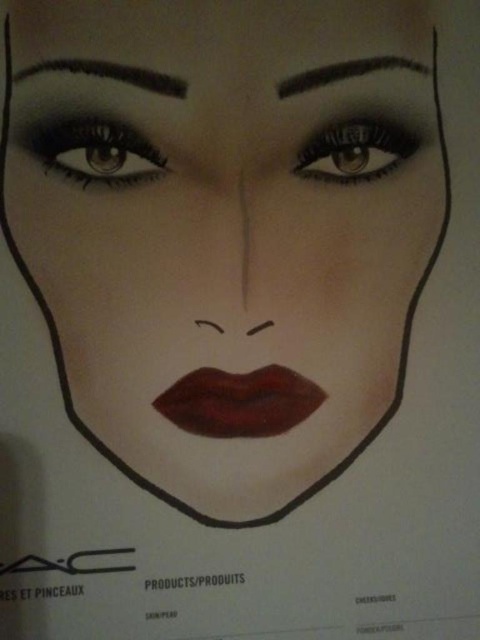
You are a makeup artist trying to apply a new lipstick shade. You have a reference point at coordinates point (240, 401) on the MAC makeup template. Which product should you apply at this point?

The point (240, 401) marks the matte brown lipstick at center, so you should apply the matte brown lipstick at that location.

Based on the MAC makeup template, where is the matte brown lipstick at center positioned relative to the face outline?

The matte brown lipstick at center is located at point coordinates of 0.628 on the x axis and 0.500 on the y axis.